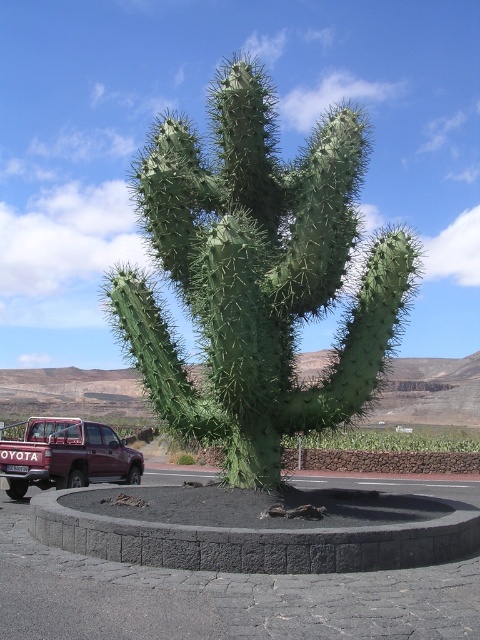
Question: Can you confirm if matte black pickup truck at center is wider than maroon metallic truck at lower left?

Choices:
 (A) no
 (B) yes

Answer: (B)

Question: Does matte black pickup truck at center have a lesser width compared to black concrete curb at center?

Choices:
 (A) no
 (B) yes

Answer: (A)

Question: Estimate the real-world distances between objects in this image. Which object is farther from the maroon metallic truck at lower left?

Choices:
 (A) matte black pickup truck at center
 (B) black concrete curb at center

Answer: (A)

Question: Which is farther from the black concrete curb at center?

Choices:
 (A) matte black pickup truck at center
 (B) maroon metallic truck at lower left

Answer: (B)

Question: Is black concrete curb at center in front of maroon metallic truck at lower left?

Choices:
 (A) no
 (B) yes

Answer: (B)

Question: Which point is farther to the camera?

Choices:
 (A) (361, 406)
 (B) (4, 448)
 (C) (297, 566)

Answer: (B)